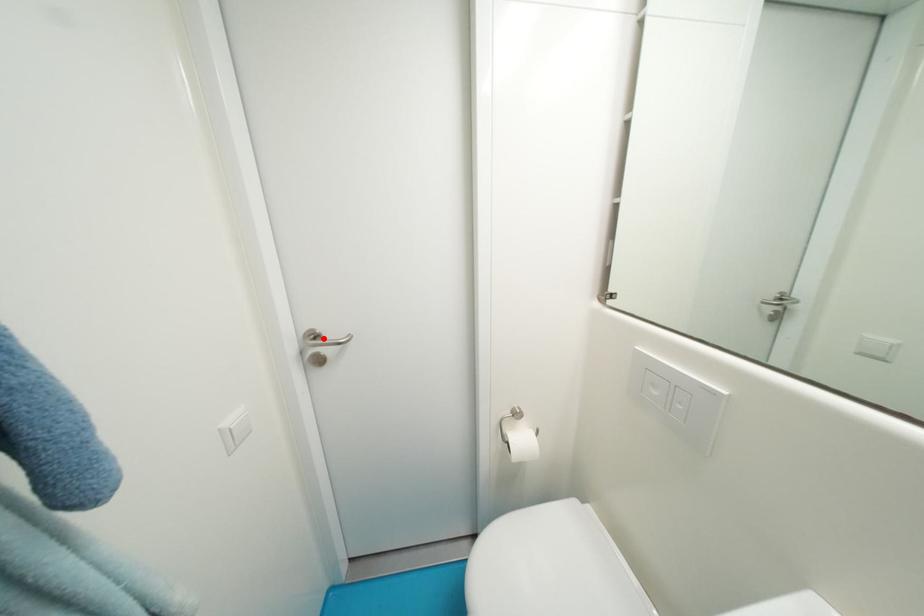
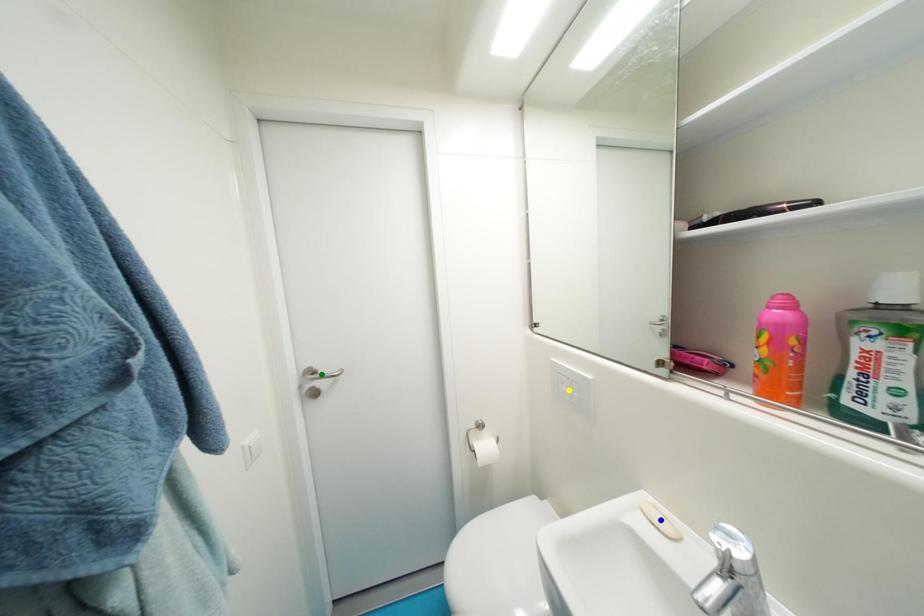
Question: I am providing you with two images of the same scene from different viewpoints. A red point is marked on the first image. You are given multiple points on the second image. Which spot in image 2 lines up with the point in image 1?

Choices:
 (A) blue point
 (B) green point
 (C) yellow point

Answer: (B)